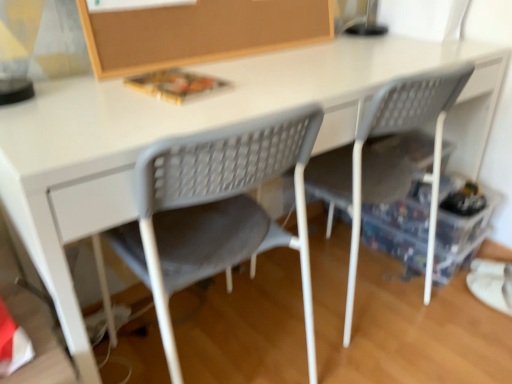
This screenshot has height=384, width=512. Find the location of `burlap board at upper center`. burlap board at upper center is located at coordinates (199, 32).

What do you see at coordinates (199, 32) in the screenshot?
I see `burlap board at upper center` at bounding box center [199, 32].

Image resolution: width=512 pixels, height=384 pixels. Describe the element at coordinates (405, 211) in the screenshot. I see `transparent plastic storage box at lower right` at that location.

Image resolution: width=512 pixels, height=384 pixels. In order to click on gray mesh chair at center, the second chair when ordered from right to left in this screenshot , I will do `click(216, 210)`.

Where is `gray plastic chair at center, the second chair positioned from the left`? gray plastic chair at center, the second chair positioned from the left is located at coordinates (386, 159).

The width and height of the screenshot is (512, 384). I want to click on burlap board at upper center, so click(199, 32).

Where is `chair below the transparent plastic storage box at lower right (from the image's perspective)`? Image resolution: width=512 pixels, height=384 pixels. chair below the transparent plastic storage box at lower right (from the image's perspective) is located at coordinates (216, 210).

Considering the sizes of objects transparent plastic storage box at lower right and gray mesh chair at center, the second chair when ordered from right to left, in the image provided, who is taller, transparent plastic storage box at lower right or gray mesh chair at center, the second chair when ordered from right to left,?

gray mesh chair at center, the second chair when ordered from right to left, is taller.

Can you confirm if transparent plastic storage box at lower right is positioned to the right of gray mesh chair at center, the second chair when ordered from right to left?

Yes, transparent plastic storage box at lower right is to the right of gray mesh chair at center, the second chair when ordered from right to left.

From the image's perspective, would you say transparent plastic storage box at lower right is shown under gray mesh chair at center, marked as the 1th chair in a left-to-right arrangement?

Incorrect, from the image's perspective, transparent plastic storage box at lower right is higher than gray mesh chair at center, marked as the 1th chair in a left-to-right arrangement.

Is gray plastic chair at center, which appears as the 1th chair when viewed from the right, thinner than burlap board at upper center?

No, gray plastic chair at center, which appears as the 1th chair when viewed from the right, is not thinner than burlap board at upper center.

You are a GUI agent. You are given a task and a screenshot of the screen. Output one action in this format:
    pyautogui.click(x=<x>, y=<y>)
    Task: Click on the bulletin board located on the left of gray plastic chair at center, the second chair positioned from the left
    Image resolution: width=512 pixels, height=384 pixels.
    Given the screenshot: What is the action you would take?
    pyautogui.click(x=199, y=32)

Between gray plastic chair at center, the second chair positioned from the left, and burlap board at upper center, which one is positioned in front?

gray plastic chair at center, the second chair positioned from the left, is in front.

Can you confirm if gray plastic chair at center, which appears as the 1th chair when viewed from the right, is positioned to the right of burlap board at upper center?

Indeed, gray plastic chair at center, which appears as the 1th chair when viewed from the right, is positioned on the right side of burlap board at upper center.

Is transparent plastic storage box at lower right aimed at gray plastic chair at center, which appears as the 1th chair when viewed from the right?

No.

Consider the image. Which object is thinner, transparent plastic storage box at lower right or gray plastic chair at center, which appears as the 1th chair when viewed from the right?

transparent plastic storage box at lower right.

Where is `storage box below the gray plastic chair at center, which appears as the 1th chair when viewed from the right (from a real-world perspective)`? storage box below the gray plastic chair at center, which appears as the 1th chair when viewed from the right (from a real-world perspective) is located at coordinates (405, 211).

Is transparent plastic storage box at lower right situated inside gray plastic chair at center, the second chair positioned from the left, or outside?

transparent plastic storage box at lower right is not inside gray plastic chair at center, the second chair positioned from the left, it's outside.

Is point (448, 74) farther from camera compared to point (499, 195)?

No, (448, 74) is in front of (499, 195).

Could you tell me if gray plastic chair at center, which appears as the 1th chair when viewed from the right, is turned towards transparent plastic storage box at lower right?

No, gray plastic chair at center, which appears as the 1th chair when viewed from the right, does not turn towards transparent plastic storage box at lower right.

How different are the orientations of gray plastic chair at center, the second chair positioned from the left, and transparent plastic storage box at lower right in degrees?

The facing directions of gray plastic chair at center, the second chair positioned from the left, and transparent plastic storage box at lower right are 178 degrees apart.

Is gray plastic chair at center, the second chair positioned from the left, situated inside transparent plastic storage box at lower right or outside?

gray plastic chair at center, the second chair positioned from the left, is not enclosed by transparent plastic storage box at lower right.

Is gray plastic chair at center, which appears as the 1th chair when viewed from the right, bigger or smaller than gray mesh chair at center, the second chair when ordered from right to left?

gray plastic chair at center, which appears as the 1th chair when viewed from the right, is bigger than gray mesh chair at center, the second chair when ordered from right to left.

Is gray mesh chair at center, marked as the 1th chair in a left-to-right arrangement, completely or partially inside gray plastic chair at center, which appears as the 1th chair when viewed from the right?

No, gray mesh chair at center, marked as the 1th chair in a left-to-right arrangement, is not surrounded by gray plastic chair at center, which appears as the 1th chair when viewed from the right.

Is gray plastic chair at center, which appears as the 1th chair when viewed from the right, at the left side of gray mesh chair at center, marked as the 1th chair in a left-to-right arrangement?

No.

Can you see gray plastic chair at center, the second chair positioned from the left, touching gray mesh chair at center, marked as the 1th chair in a left-to-right arrangement?

No.

Which of these two, transparent plastic storage box at lower right or burlap board at upper center, is wider?

transparent plastic storage box at lower right.

Can you tell me how much transparent plastic storage box at lower right and burlap board at upper center differ in facing direction?

They differ by 1.56 degrees in their facing directions.

Would you say transparent plastic storage box at lower right is outside burlap board at upper center?

That's correct, transparent plastic storage box at lower right is outside of burlap board at upper center.

Are transparent plastic storage box at lower right and burlap board at upper center beside each other?

No, transparent plastic storage box at lower right is not in contact with burlap board at upper center.

Is gray mesh chair at center, marked as the 1th chair in a left-to-right arrangement, aimed at transparent plastic storage box at lower right?

No, gray mesh chair at center, marked as the 1th chair in a left-to-right arrangement, is not turned towards transparent plastic storage box at lower right.

From the image's perspective, which is below, gray mesh chair at center, marked as the 1th chair in a left-to-right arrangement, or transparent plastic storage box at lower right?

gray mesh chair at center, marked as the 1th chair in a left-to-right arrangement, from the image's perspective.

How different are the orientations of gray mesh chair at center, marked as the 1th chair in a left-to-right arrangement, and transparent plastic storage box at lower right in degrees?

There is a 179-degree angle between the facing directions of gray mesh chair at center, marked as the 1th chair in a left-to-right arrangement, and transparent plastic storage box at lower right.

The width and height of the screenshot is (512, 384). Find the location of `the 2nd chair to the left when counting from the transparent plastic storage box at lower right`. the 2nd chair to the left when counting from the transparent plastic storage box at lower right is located at coordinates (216, 210).

The height and width of the screenshot is (384, 512). Find the location of `the 1st chair directly above the transparent plastic storage box at lower right (from a real-world perspective)`. the 1st chair directly above the transparent plastic storage box at lower right (from a real-world perspective) is located at coordinates (216, 210).

Which chair is the 1st one when counting from the front of the burlap board at upper center? Please provide its 2D coordinates.

[(386, 159)]

Estimate the real-world distances between objects in this image. Which object is further from gray plastic chair at center, which appears as the 1th chair when viewed from the right, transparent plastic storage box at lower right or gray mesh chair at center, the second chair when ordered from right to left?

gray mesh chair at center, the second chair when ordered from right to left, is positioned further to the anchor gray plastic chair at center, which appears as the 1th chair when viewed from the right.

Looking at the image, which one is located closer to burlap board at upper center, gray plastic chair at center, which appears as the 1th chair when viewed from the right, or transparent plastic storage box at lower right?

gray plastic chair at center, which appears as the 1th chair when viewed from the right, is closer to burlap board at upper center.

Which object lies nearer to the anchor point transparent plastic storage box at lower right, burlap board at upper center or gray plastic chair at center, the second chair positioned from the left?

gray plastic chair at center, the second chair positioned from the left, is positioned closer to the anchor transparent plastic storage box at lower right.

When comparing their distances from burlap board at upper center, does gray mesh chair at center, the second chair when ordered from right to left, or gray plastic chair at center, which appears as the 1th chair when viewed from the right, seem closer?

Based on the image, gray mesh chair at center, the second chair when ordered from right to left, appears to be nearer to burlap board at upper center.

Looking at the image, which one is located closer to burlap board at upper center, gray mesh chair at center, the second chair when ordered from right to left, or transparent plastic storage box at lower right?

The object closer to burlap board at upper center is gray mesh chair at center, the second chair when ordered from right to left.

Estimate the real-world distances between objects in this image. Which object is closer to burlap board at upper center, transparent plastic storage box at lower right or gray plastic chair at center, which appears as the 1th chair when viewed from the right?

Based on the image, gray plastic chair at center, which appears as the 1th chair when viewed from the right, appears to be nearer to burlap board at upper center.

Which object lies further to the anchor point gray mesh chair at center, the second chair when ordered from right to left, transparent plastic storage box at lower right or burlap board at upper center?

transparent plastic storage box at lower right lies further to gray mesh chair at center, the second chair when ordered from right to left, than the other object.

Looking at the image, which one is located further to gray mesh chair at center, the second chair when ordered from right to left, gray plastic chair at center, which appears as the 1th chair when viewed from the right, or burlap board at upper center?

Based on the image, burlap board at upper center appears to be further to gray mesh chair at center, the second chair when ordered from right to left.

Locate an element on the screen. This screenshot has height=384, width=512. bulletin board between gray mesh chair at center, marked as the 1th chair in a left-to-right arrangement, and transparent plastic storage box at lower right from left to right is located at coordinates (199, 32).

Where is `chair located between burlap board at upper center and transparent plastic storage box at lower right in the left-right direction`? chair located between burlap board at upper center and transparent plastic storage box at lower right in the left-right direction is located at coordinates (386, 159).

Locate an element on the screen. chair between burlap board at upper center and gray mesh chair at center, marked as the 1th chair in a left-to-right arrangement, in the up-down direction is located at coordinates (386, 159).

Find the location of `chair located between gray mesh chair at center, the second chair when ordered from right to left, and transparent plastic storage box at lower right in the left-right direction`. chair located between gray mesh chair at center, the second chair when ordered from right to left, and transparent plastic storage box at lower right in the left-right direction is located at coordinates (386, 159).